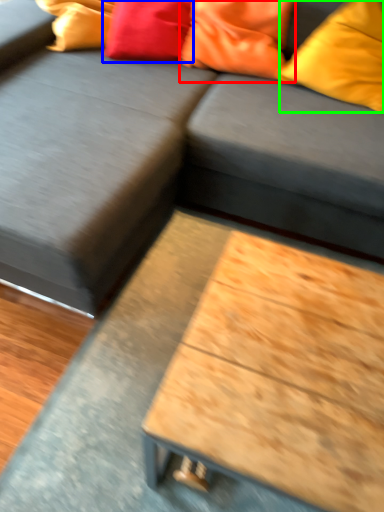
Question: Which object is the farthest from pillow (highlighted by a red box)? Choose among these: pillow (highlighted by a blue box) or pillow (highlighted by a green box).

Choices:
 (A) pillow
 (B) pillow

Answer: (B)